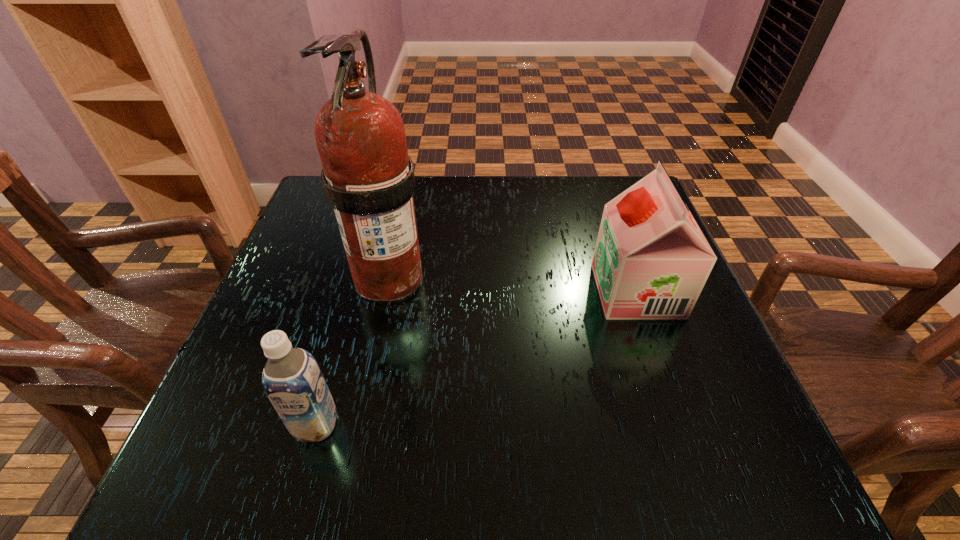
This screenshot has width=960, height=540. In order to click on free location that satisfies the following two spatial constraints: 1. with the cap open on the right soya milk; 2. on the label of the nearer soya milk in this screenshot , I will do `click(684, 424)`.

Identify the location of vacant space that satisfies the following two spatial constraints: 1. with the cap open on the taller soya milk; 2. on the label of the nearer soya milk. Image resolution: width=960 pixels, height=540 pixels. (684, 424).